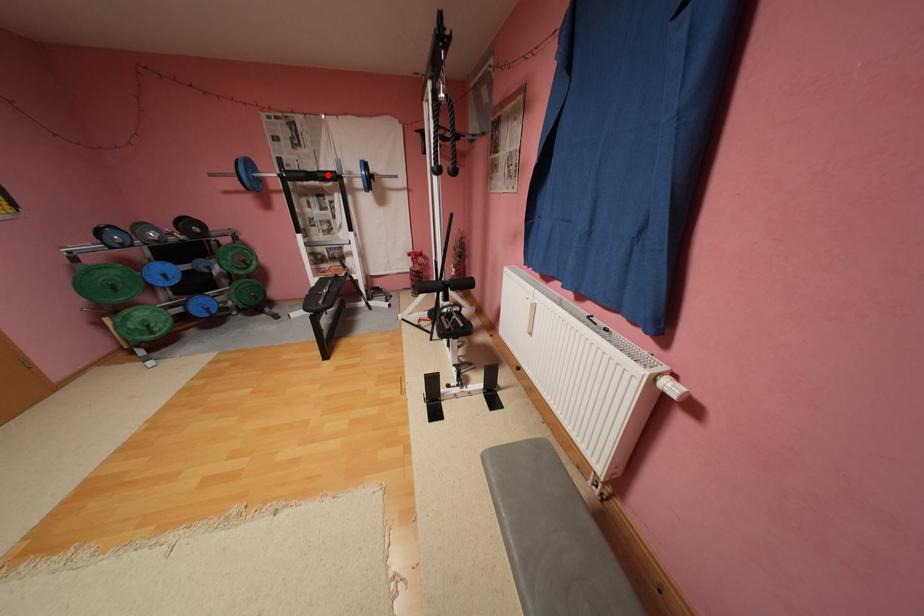
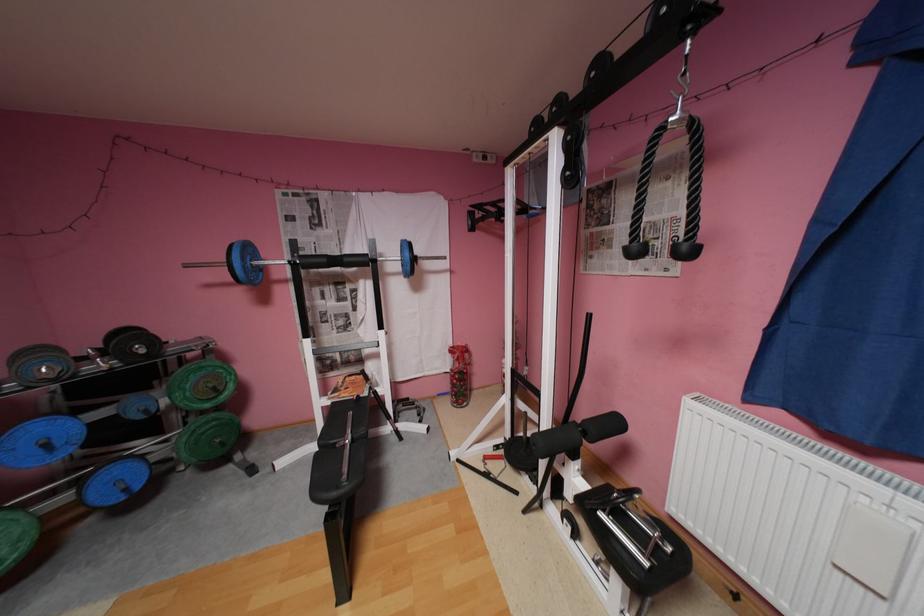
In the second image, find the point that corresponds to the highlighted location in the first image.

(355, 259)